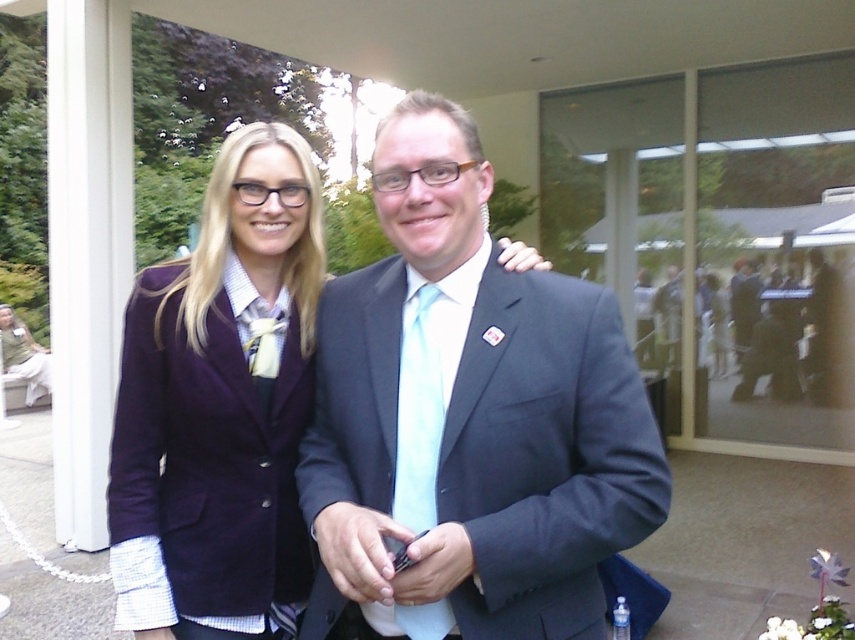
Between matte black suit at center and purple velvet blazer at center, which one appears on the right side from the viewer's perspective?

matte black suit at center is more to the right.

Is point (600, 406) closer to camera compared to point (258, 236)?

Yes.

At what (x,y) coordinates should I click in order to perform the action: click on matte black suit at center. Please return your answer as a coordinate pair (x, y). This screenshot has width=855, height=640. Looking at the image, I should click on (469, 419).